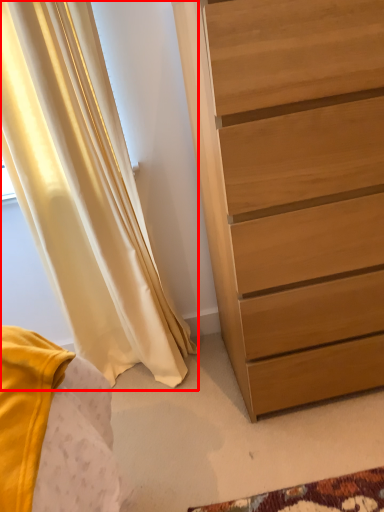
Question: From the image's perspective, what is the correct spatial positioning of curtain (annotated by the red box) in reference to chest of drawers?

Choices:
 (A) below
 (B) above

Answer: (A)